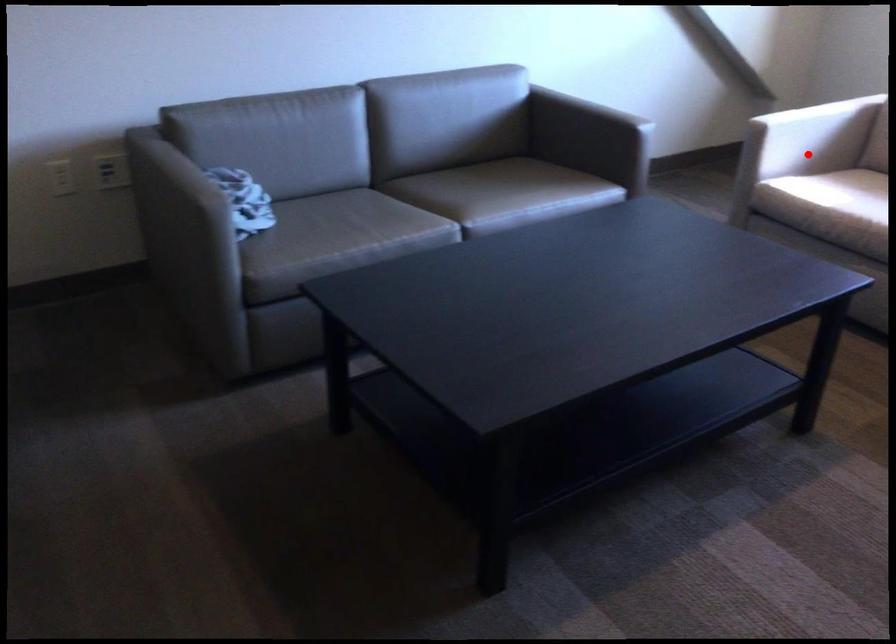
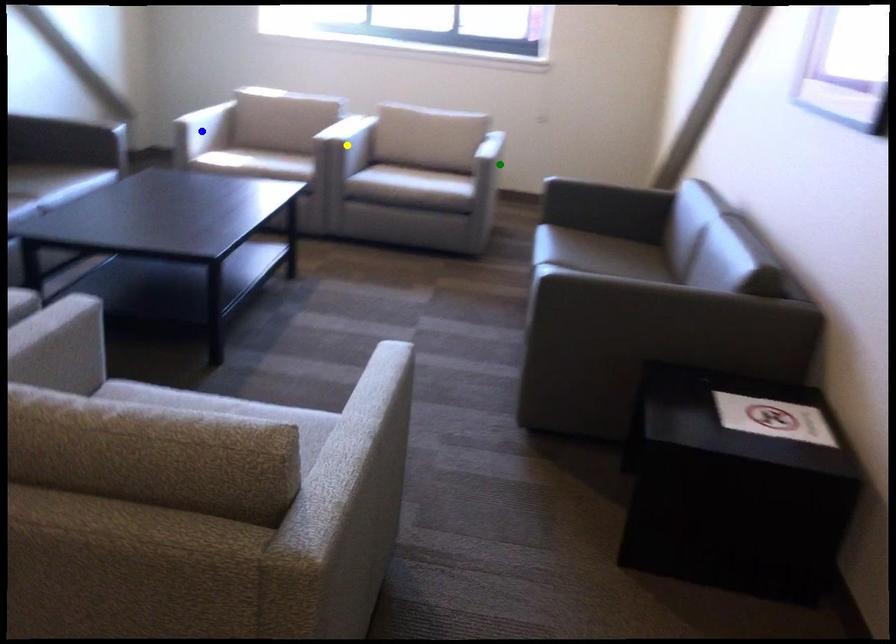
Question: I am providing you with two images of the same scene from different viewpoints. A red point is marked on the first image. You are given multiple points on the second image. Can you choose the point in image 2 that corresponds to the point in image 1?

Choices:
 (A) blue point
 (B) green point
 (C) yellow point

Answer: (A)